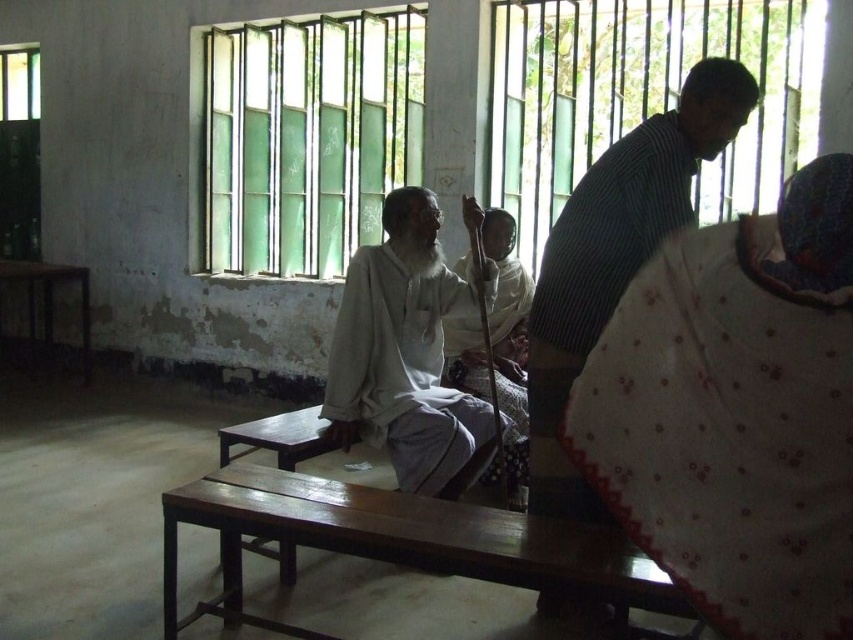
Question: Which of these objects is positioned closest to the light gray fabric at center?

Choices:
 (A) white cotton robe at center
 (B) wooden bench at center
 (C) white dotted fabric at lower right

Answer: (A)

Question: Which object is the closest to the white dotted fabric at lower right?

Choices:
 (A) wooden bench at center
 (B) striped fabric shirt at upper right

Answer: (B)

Question: Can you confirm if striped fabric shirt at upper right is wider than wooden table at left?

Choices:
 (A) yes
 (B) no

Answer: (B)

Question: Does light gray fabric at center have a larger size compared to white cotton robe at center?

Choices:
 (A) yes
 (B) no

Answer: (A)

Question: Is the position of light gray fabric at center less distant than that of wooden table at left?

Choices:
 (A) yes
 (B) no

Answer: (A)

Question: Which point appears farthest from the camera in this image?

Choices:
 (A) (769, 520)
 (B) (194, 500)
 (C) (364, 355)
 (D) (49, 340)

Answer: (D)